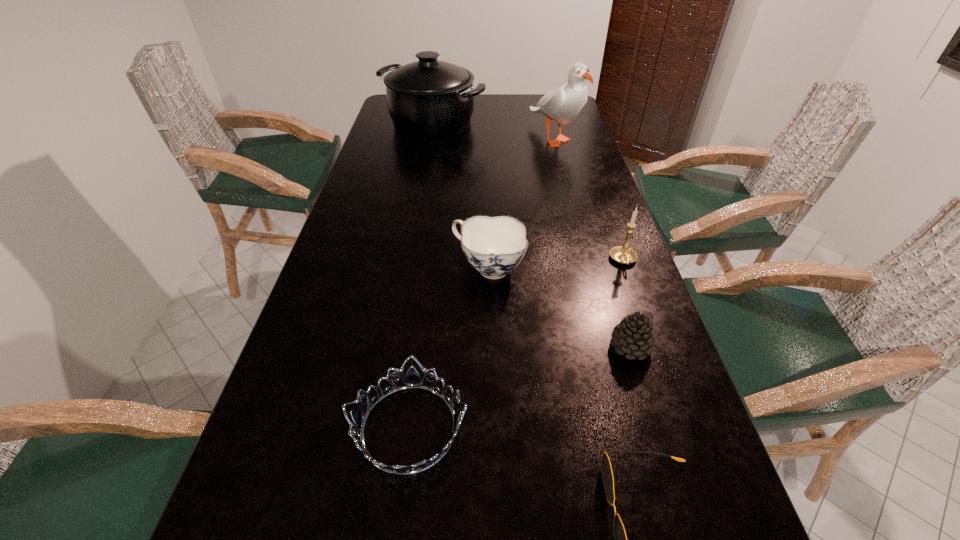
In order to click on object at the far left corner in this screenshot , I will do `click(429, 99)`.

In the image, there is a desktop. Find the location of `vacant space at the far edge`. vacant space at the far edge is located at coordinates (499, 109).

In the image, there is a desktop. Where is `free space at the left edge`? The image size is (960, 540). free space at the left edge is located at coordinates (291, 454).

The image size is (960, 540). In the image, there is a desktop. Identify the location of vacant space at the right edge. (648, 538).

Identify the location of free spot between the gull and the fourth shortest object. This screenshot has height=540, width=960. (521, 203).

The height and width of the screenshot is (540, 960). I want to click on vacant point located between the third tallest object and the pinecone, so click(x=627, y=303).

What are the coordinates of `free space that is in between the fifth tallest object and the gull` in the screenshot? It's located at (592, 242).

Where is `object that is the closest to the third nearest object`? The image size is (960, 540). object that is the closest to the third nearest object is located at coordinates (623, 254).

Locate which object is the third closest to the candle holder. Please provide its 2D coordinates. Your answer should be formatted as a tuple, i.e. [(x, y)], where the tuple contains the x and y coordinates of a point satisfying the conditions above.

[(412, 380)]